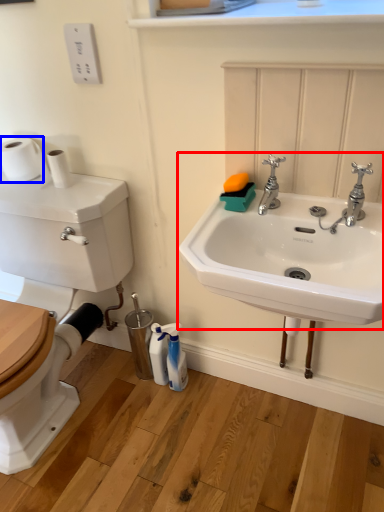
Question: Which of the following is the closest to the observer, sink (highlighted by a red box) or toilet paper (highlighted by a blue box)?

Choices:
 (A) sink
 (B) toilet paper

Answer: (A)